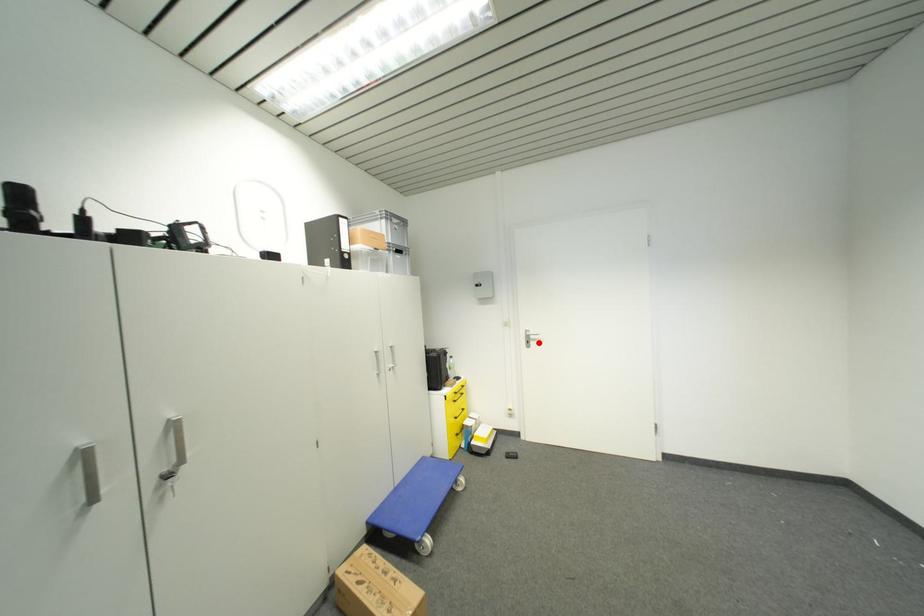
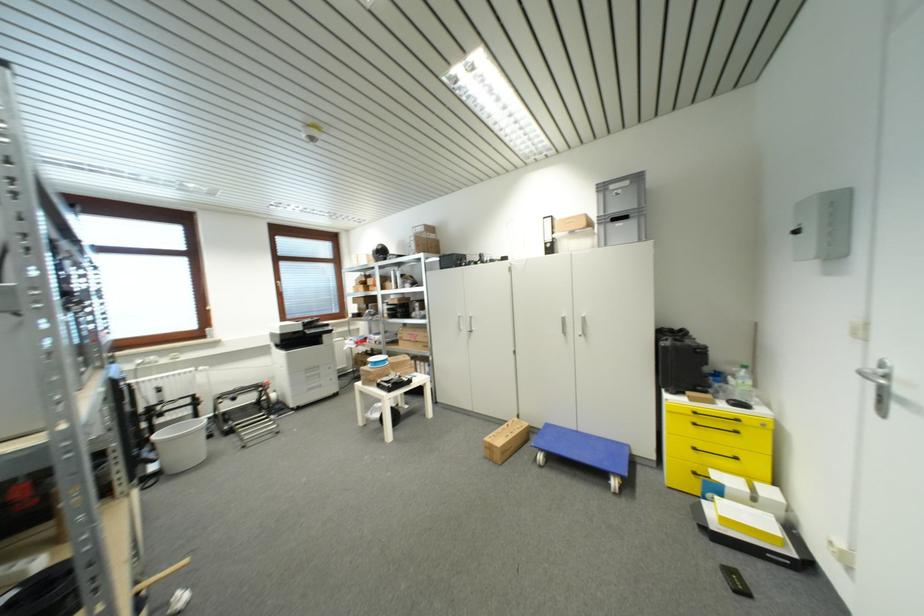
Where in the second image is the point corresponding to the highlighted location from the first image?

(909, 405)